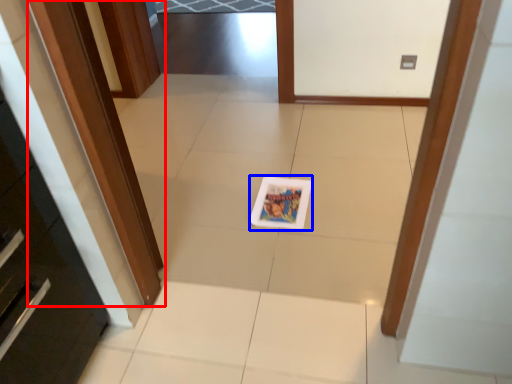
Question: Which point is closer to the camera, door (highlighted by a red box) or postcard (highlighted by a blue box)?

Choices:
 (A) door
 (B) postcard

Answer: (A)